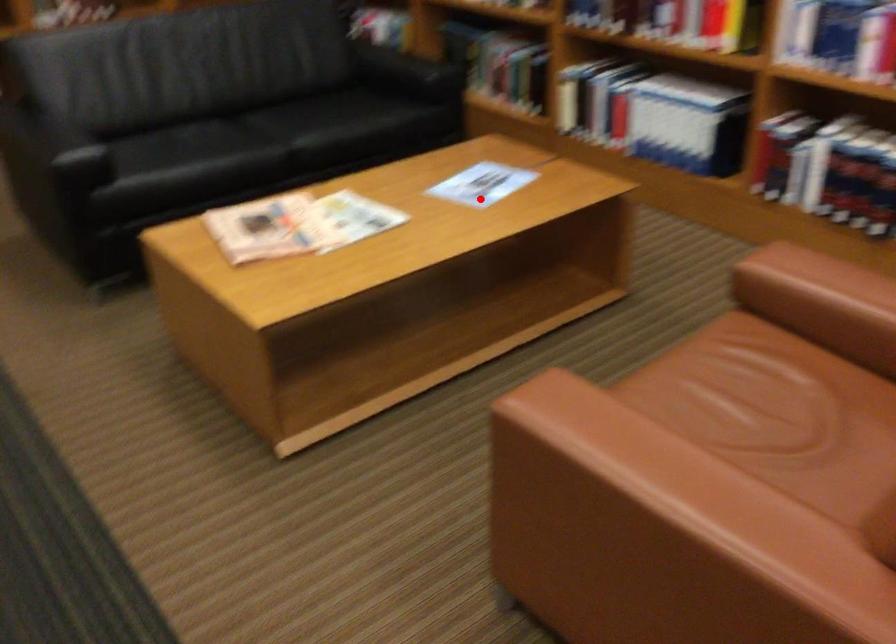
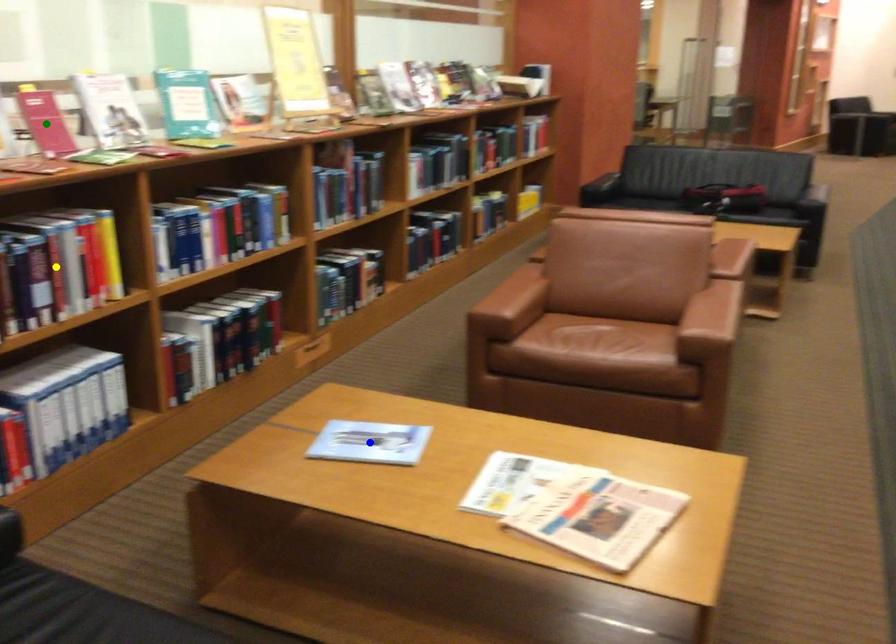
Question: I am providing you with two images of the same scene from different viewpoints. A red point is marked on the first image. You are given multiple points on the second image. Which point in image 2 represents the same 3d spot as the red point in image 1?

Choices:
 (A) blue point
 (B) yellow point
 (C) green point

Answer: (A)